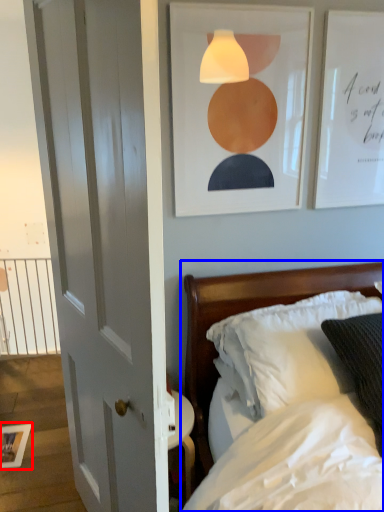
Question: Among these objects, which one is farthest to the camera, picture frame (highlighted by a red box) or bed (highlighted by a blue box)?

Choices:
 (A) picture frame
 (B) bed

Answer: (A)